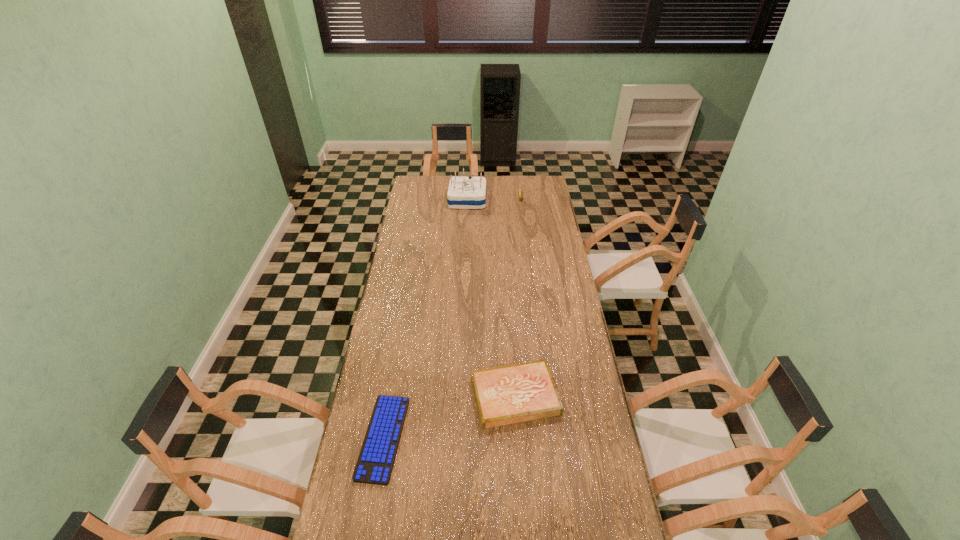
You are a GUI agent. You are given a task and a screenshot of the screen. Output one action in this format:
    pyautogui.click(x=<x>, y=<y>)
    Task: Click on the banana positioned at the far edge
    The height and width of the screenshot is (540, 960).
    Given the screenshot: What is the action you would take?
    pyautogui.click(x=520, y=191)

At what (x,y) coordinates should I click in order to perform the action: click on object that is at the left edge. Please return your answer as a coordinate pair (x, y). The image size is (960, 540). Looking at the image, I should click on coord(375,463).

Identify the location of object that is at the right edge. This screenshot has height=540, width=960. (516, 393).

In order to click on free spot at the far edge of the desktop in this screenshot , I will do coord(443,194).

The height and width of the screenshot is (540, 960). What are the coordinates of `blank area at the left edge` in the screenshot? It's located at (394, 339).

You are a GUI agent. You are given a task and a screenshot of the screen. Output one action in this format:
    pyautogui.click(x=<x>, y=<y>)
    Task: Click on the vacant area at the right edge of the desktop
    
    Given the screenshot: What is the action you would take?
    pyautogui.click(x=549, y=347)

Find the location of `vacant space that's between the second tallest object and the birthday cake`. vacant space that's between the second tallest object and the birthday cake is located at coordinates (494, 198).

Identify the location of vacant space in between the computer keyboard and the second tallest object. The image size is (960, 540). 452,317.

The width and height of the screenshot is (960, 540). Find the location of `free space between the banana and the shortest object`. free space between the banana and the shortest object is located at coordinates (452, 317).

Find the location of `free space between the third tallest object and the third shortest object`. free space between the third tallest object and the third shortest object is located at coordinates (517, 296).